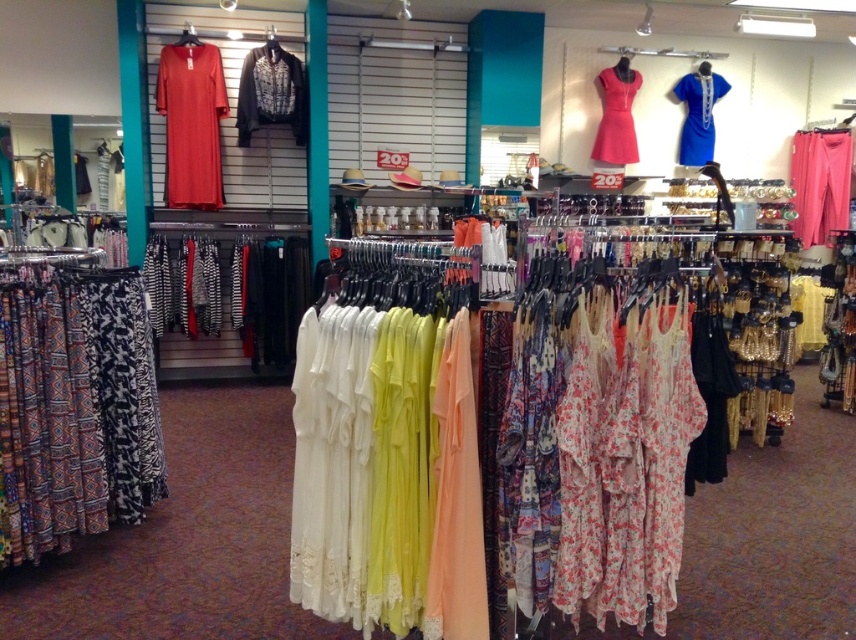
From the picture: You are a customer in the store and want to know if the printed cotton skirt at left can be seen from the same angle as the matte red dress at upper left. Based on their heights, can you see both items at the same time?

The printed cotton skirt at left is not as tall as matte red dress at upper left, so the shorter printed cotton skirt at left may be partially obscured by the taller matte red dress at upper left. Therefore, you might not see both items at the same angle.

You are a customer in the clothing store and want to find the printed cotton skirt at left. Based on the store layout, where should you look relative to the long dresses displayed in the foreground?

The printed cotton skirt at left is located to the left of the long dresses in the foreground.

In the scene shown: You are a customer in the store and want to know which item takes up more space when placed on a shelf. Which one is larger between the pink fabric pants at right and the matte pink dress at upper center?

The pink fabric pants at right is bigger than the matte pink dress at upper center, so it takes up more space when placed on a shelf.